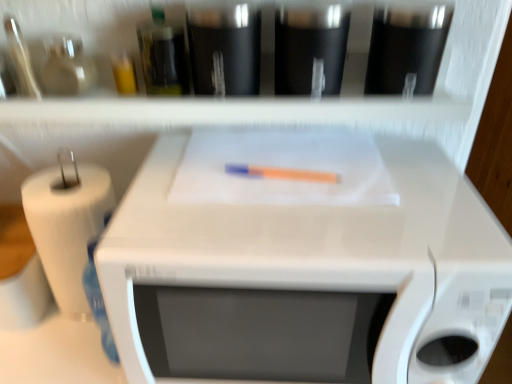
Question: Considering the positions of point (67, 165) and point (212, 281), is point (67, 165) closer or farther from the camera than point (212, 281)?

Choices:
 (A) closer
 (B) farther

Answer: (B)

Question: Is white paper at left wider or thinner than white glossy microwave at center?

Choices:
 (A) thin
 (B) wide

Answer: (A)

Question: Which object is positioned farthest from the white glossy microwave at center?

Choices:
 (A) white matte shelf at upper center
 (B) white paper at left
 (C) orange matte crayon at center

Answer: (B)

Question: Which of these objects is positioned closest to the white paper at left?

Choices:
 (A) white glossy microwave at center
 (B) orange matte crayon at center
 (C) white matte shelf at upper center

Answer: (A)